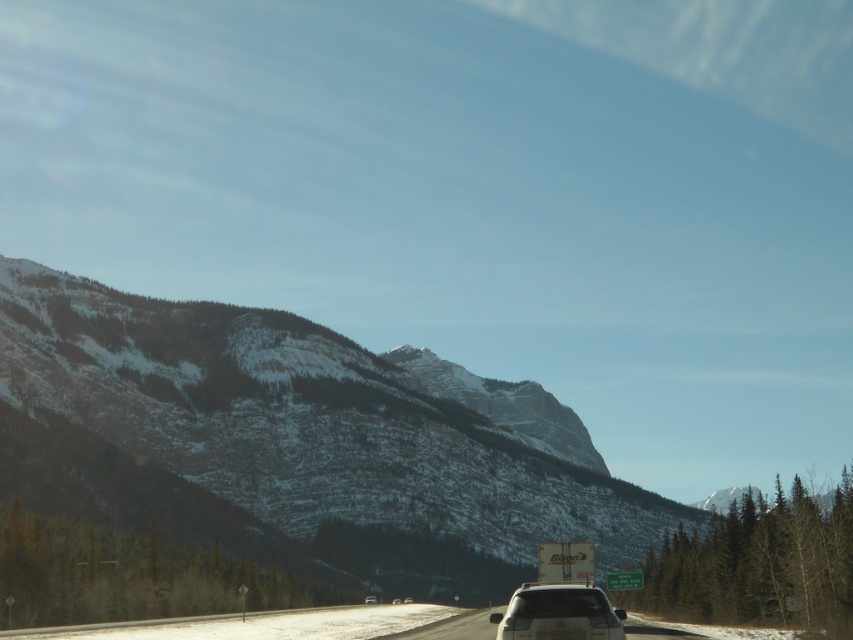
You are a photographer planning to capture a wide shot of the snowy rock mountain at center and the white matte car at center. Based on their sizes in the image, which object should you focus on first to ensure both are in frame?

The snowy rock mountain at center might be wider than the white matte car at center, so focusing on the snowy rock mountain at center first would ensure both fit within the frame.

You are a driver approaching the white matte car at center on the highway. You notice a snowy rock mountain at center in the background. According to the scene, which direction should you steer to avoid hitting the car?

The snowy rock mountain at center is to the left of the white matte car at center, so you should steer to the right to avoid hitting the car and stay on the highway.